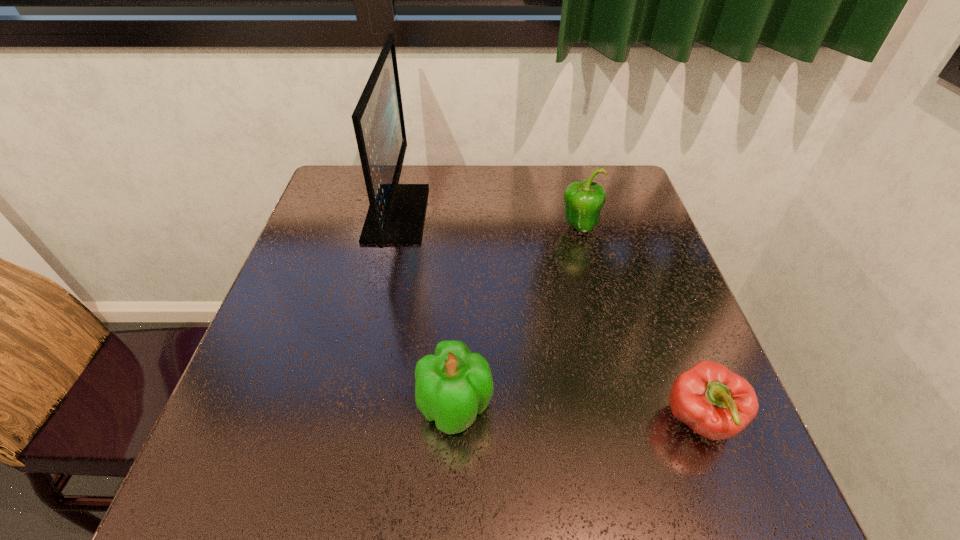
This screenshot has height=540, width=960. I want to click on vacant area situated 0.060m on the left of the rightmost bell pepper, so click(629, 421).

At what (x,y) coordinates should I click in order to perform the action: click on object present at the far edge. Please return your answer as a coordinate pair (x, y). The image size is (960, 540). Looking at the image, I should click on (396, 213).

Where is `object located at the near edge`? This screenshot has width=960, height=540. object located at the near edge is located at coordinates (716, 403).

The width and height of the screenshot is (960, 540). Find the location of `object situated at the left edge`. object situated at the left edge is located at coordinates (396, 213).

Identify the location of object that is positioned at the far left corner. (396, 213).

You are a GUI agent. You are given a task and a screenshot of the screen. Output one action in this format:
    pyautogui.click(x=<x>, y=<y>)
    Task: Click on the object that is at the near right corner
    This screenshot has height=540, width=960.
    Given the screenshot: What is the action you would take?
    pyautogui.click(x=716, y=403)

Find the location of a particular element. The width and height of the screenshot is (960, 540). free point at the far edge is located at coordinates (414, 176).

Locate an element on the screen. Image resolution: width=960 pixels, height=540 pixels. free space at the near edge is located at coordinates (439, 455).

Identify the location of free space at the left edge of the desktop. (327, 228).

Identify the location of free space at the right edge of the desktop. (644, 249).